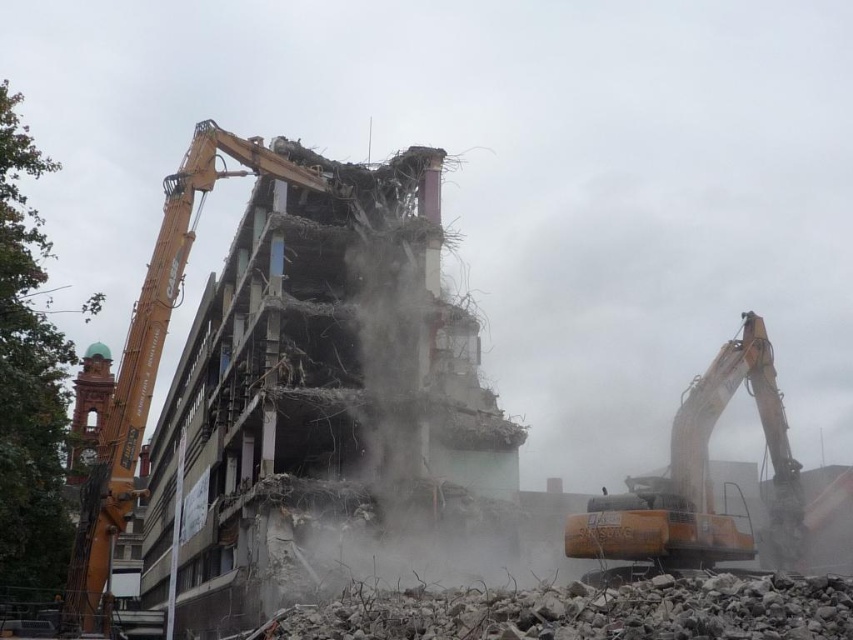
Question: Is orange metallic excavator at right to the left of orange metallic crane at left from the viewer's perspective?

Choices:
 (A) no
 (B) yes

Answer: (A)

Question: Which of the following is the farthest from the observer?

Choices:
 (A) (727, 518)
 (B) (256, 136)

Answer: (B)

Question: Is orange metallic excavator at right above orange metallic crane at left?

Choices:
 (A) yes
 (B) no

Answer: (B)

Question: Considering the relative positions of orange metallic excavator at right and orange metallic crane at left in the image provided, where is orange metallic excavator at right located with respect to orange metallic crane at left?

Choices:
 (A) above
 (B) below

Answer: (B)

Question: Which of the following is the closest to the observer?

Choices:
 (A) orange metallic crane at left
 (B) orange metallic excavator at right

Answer: (B)